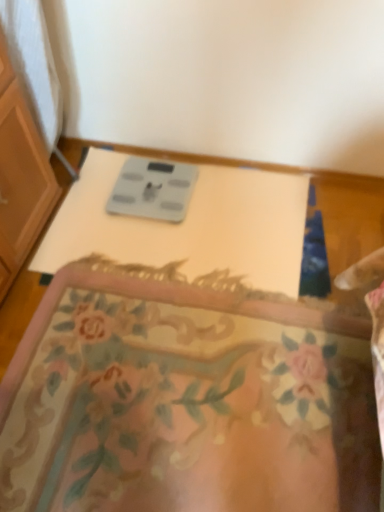
Question: From the image's perspective, is gray plastic scale at center located beneath floral carpet at center?

Choices:
 (A) no
 (B) yes

Answer: (A)

Question: Is gray plastic scale at center taller than floral carpet at center?

Choices:
 (A) no
 (B) yes

Answer: (B)

Question: Is gray plastic scale at center smaller than floral carpet at center?

Choices:
 (A) yes
 (B) no

Answer: (A)

Question: Is gray plastic scale at center oriented towards floral carpet at center?

Choices:
 (A) no
 (B) yes

Answer: (B)

Question: Would you say gray plastic scale at center is a long distance from floral carpet at center?

Choices:
 (A) yes
 (B) no

Answer: (B)

Question: Is gray matte scale at center in front of or behind gray plastic scale at center in the image?

Choices:
 (A) behind
 (B) front

Answer: (A)

Question: From the image's perspective, is gray matte scale at center above or below gray plastic scale at center?

Choices:
 (A) below
 (B) above

Answer: (B)

Question: Is gray matte scale at center spatially inside gray plastic scale at center, or outside of it?

Choices:
 (A) outside
 (B) inside

Answer: (B)

Question: Is gray matte scale at center wider or thinner than gray plastic scale at center?

Choices:
 (A) thin
 (B) wide

Answer: (A)

Question: From their relative heights in the image, would you say gray matte scale at center is taller or shorter than floral carpet at center?

Choices:
 (A) short
 (B) tall

Answer: (A)

Question: Is gray matte scale at center inside or outside of floral carpet at center?

Choices:
 (A) outside
 (B) inside

Answer: (A)

Question: In the image, is gray matte scale at center positioned in front of or behind floral carpet at center?

Choices:
 (A) behind
 (B) front

Answer: (A)

Question: Based on their sizes in the image, would you say gray matte scale at center is bigger or smaller than floral carpet at center?

Choices:
 (A) small
 (B) big

Answer: (A)

Question: From the image's perspective, is floral carpet at center located above or below gray plastic scale at center?

Choices:
 (A) below
 (B) above

Answer: (A)

Question: Do you think floral carpet at center is within gray plastic scale at center, or outside of it?

Choices:
 (A) inside
 (B) outside

Answer: (B)